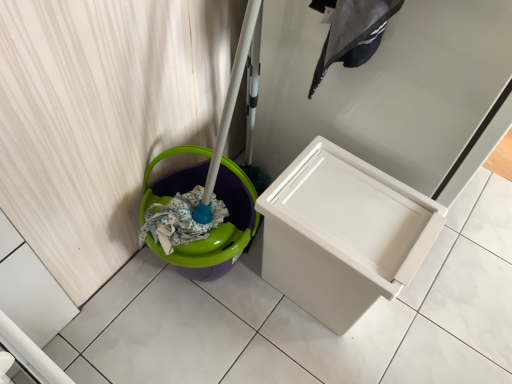
Question: Considering the relative sizes of white plastic waste container at center and dark gray fabric laundry at upper center in the image provided, is white plastic waste container at center smaller than dark gray fabric laundry at upper center?

Choices:
 (A) yes
 (B) no

Answer: (B)

Question: Is white plastic waste container at center to the right of dark gray fabric laundry at upper center from the viewer's perspective?

Choices:
 (A) yes
 (B) no

Answer: (A)

Question: Would you consider white plastic waste container at center to be distant from dark gray fabric laundry at upper center?

Choices:
 (A) yes
 (B) no

Answer: (B)

Question: Is white plastic waste container at center located outside dark gray fabric laundry at upper center?

Choices:
 (A) no
 (B) yes

Answer: (B)

Question: From a real-world perspective, is white plastic waste container at center beneath dark gray fabric laundry at upper center?

Choices:
 (A) yes
 (B) no

Answer: (A)

Question: Considering their positions, is white plastic waste container at center located in front of or behind white plastic drawer at center?

Choices:
 (A) front
 (B) behind

Answer: (B)

Question: Is white plastic waste container at center spatially inside white plastic drawer at center, or outside of it?

Choices:
 (A) outside
 (B) inside

Answer: (A)

Question: In terms of width, does white plastic waste container at center look wider or thinner when compared to white plastic drawer at center?

Choices:
 (A) wide
 (B) thin

Answer: (B)

Question: Is white plastic waste container at center taller or shorter than white plastic drawer at center?

Choices:
 (A) tall
 (B) short

Answer: (B)

Question: From a real-world perspective, relative to white plastic waste container at center, is dark gray fabric laundry at upper center vertically above or below?

Choices:
 (A) below
 (B) above

Answer: (B)

Question: In terms of size, does dark gray fabric laundry at upper center appear bigger or smaller than white plastic waste container at center?

Choices:
 (A) big
 (B) small

Answer: (B)

Question: Relative to white plastic waste container at center, is dark gray fabric laundry at upper center in front or behind?

Choices:
 (A) front
 (B) behind

Answer: (A)

Question: Would you say dark gray fabric laundry at upper center is to the left or to the right of white plastic waste container at center in the picture?

Choices:
 (A) right
 (B) left

Answer: (B)

Question: From a real-world perspective, is dark gray fabric laundry at upper center positioned above or below white plastic drawer at center?

Choices:
 (A) above
 (B) below

Answer: (A)

Question: From their relative heights in the image, would you say dark gray fabric laundry at upper center is taller or shorter than white plastic drawer at center?

Choices:
 (A) short
 (B) tall

Answer: (A)